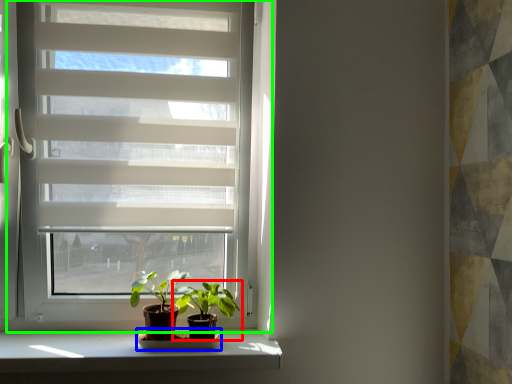
Question: Estimate the real-world distances between objects in this image. Which object is farther from houseplant (highlighted by a red box), shelf (highlighted by a blue box) or window (highlighted by a green box)?

Choices:
 (A) shelf
 (B) window

Answer: (B)